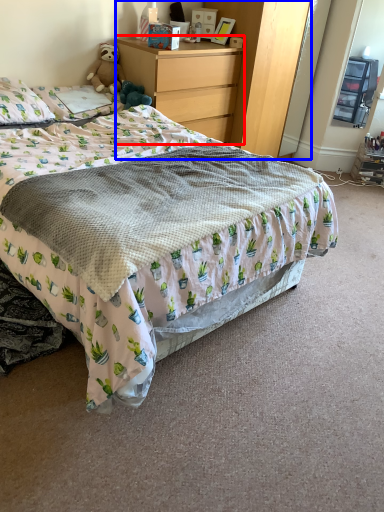
Question: Which object appears farthest to the camera in this image, chest of drawers (highlighted by a red box) or dresser (highlighted by a blue box)?

Choices:
 (A) chest of drawers
 (B) dresser

Answer: (B)